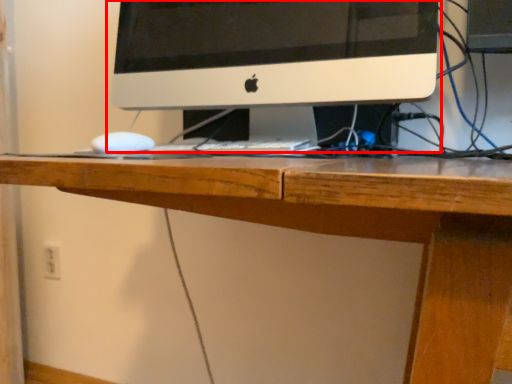
Question: Considering the relative positions of computer monitor (annotated by the red box) and electric outlet in the image provided, where is computer monitor (annotated by the red box) located with respect to the staircase?

Choices:
 (A) right
 (B) left

Answer: (A)